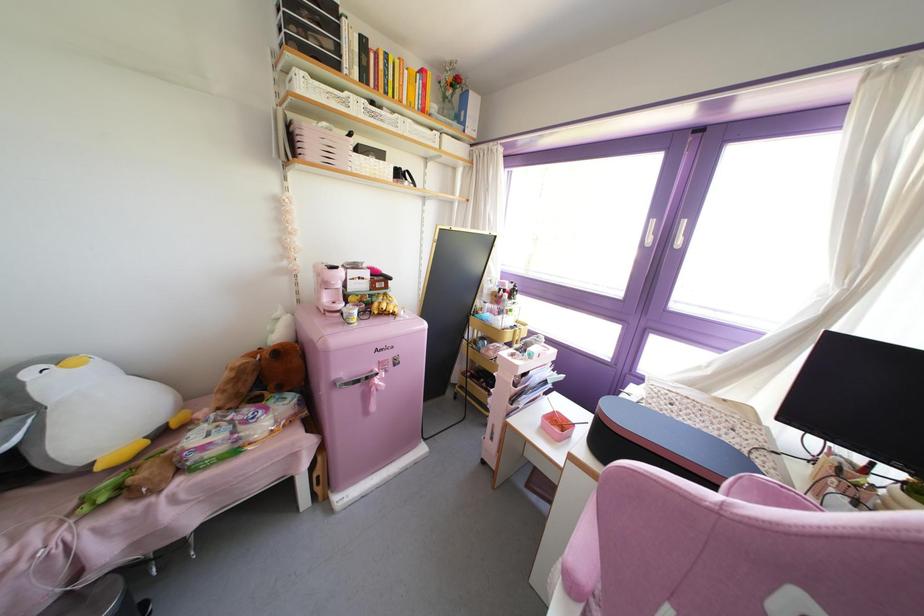
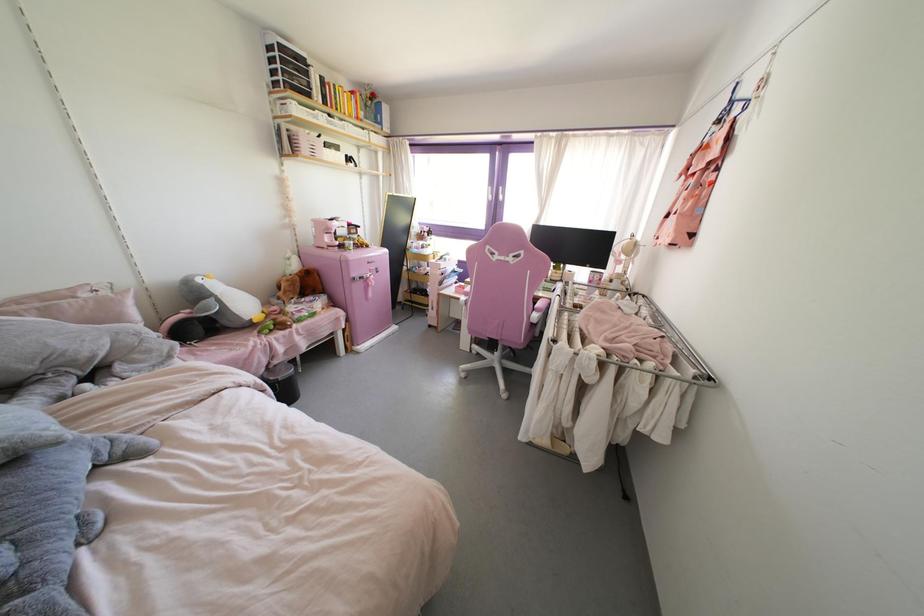
In the second image, find the point that corresponds to point (330, 509) in the first image.

(357, 352)